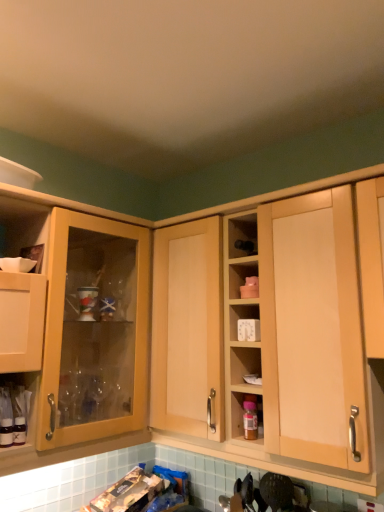
Question: In terms of size, does translucent glass bottles at lower left appear bigger or smaller than translucent plastic bottle at center-right?

Choices:
 (A) small
 (B) big

Answer: (B)

Question: From the image's perspective, is translucent glass bottles at lower left above or below translucent plastic bottle at center-right?

Choices:
 (A) below
 (B) above

Answer: (B)

Question: Considering the real-world distances, which object is farthest from the matte wood cabinet at left, positioned as the 2th cabinetry in right-to-left order?

Choices:
 (A) translucent plastic bottle at center-right
 (B) translucent glass bottles at lower left
 (C) light wood cabinet at center, arranged as the second cabinetry when viewed from the left

Answer: (A)

Question: Which object is positioned closest to the translucent glass bottles at lower left?

Choices:
 (A) light wood cabinet at center, which is the first cabinetry from right to left
 (B) matte wood cabinet at left, positioned as the first cabinetry in left-to-right order
 (C) translucent plastic bottle at center-right

Answer: (A)